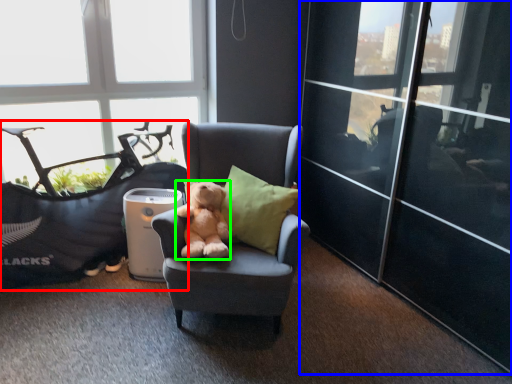
Question: Based on their relative distances, which object is farther from bean bag chair (highlighted by a red box)? Choose from glass door (highlighted by a blue box) and teddy bear (highlighted by a green box).

Choices:
 (A) glass door
 (B) teddy bear

Answer: (A)